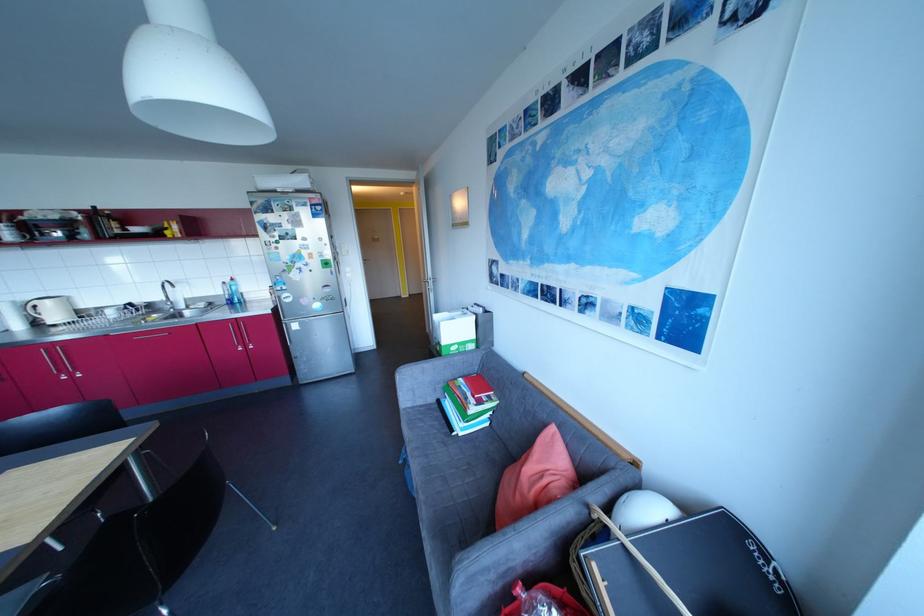
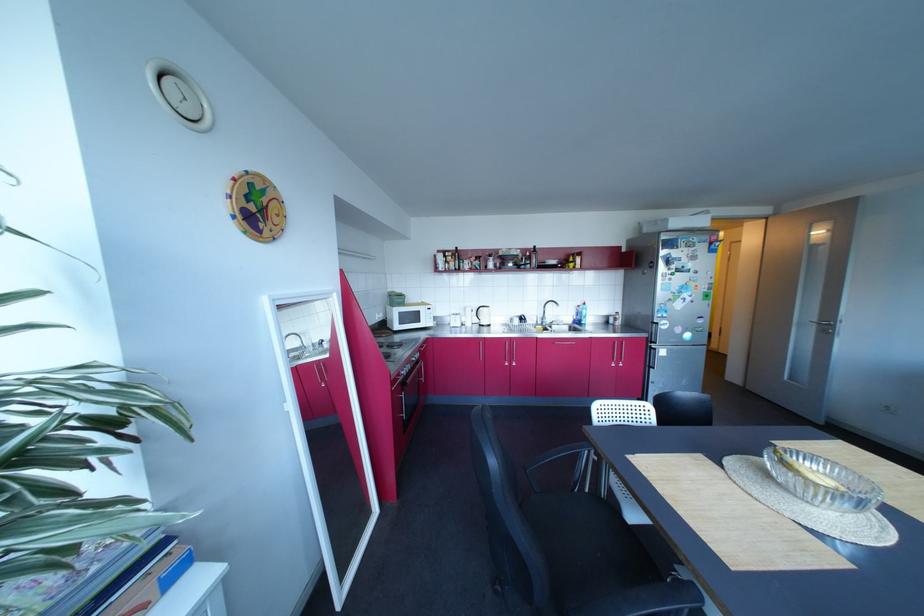
Question: Which direction would the cameraman need to move to produce the second image? Reply with the corresponding letter.

Choices:
 (A) Left
 (B) Right
 (C) Forward
 (D) Backward

Answer: (A)